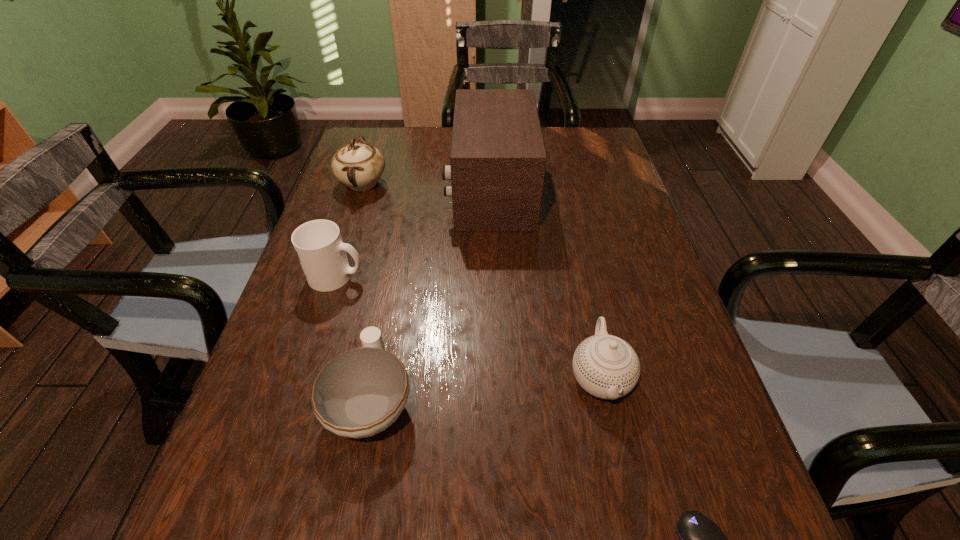
I want to click on object located at the far left corner, so (x=359, y=166).

Where is `free space at the far edge of the desktop`? free space at the far edge of the desktop is located at coordinates (553, 144).

I want to click on free location at the left edge, so click(372, 194).

The image size is (960, 540). I want to click on vacant space at the far left corner of the desktop, so click(x=398, y=127).

You are a GUI agent. You are given a task and a screenshot of the screen. Output one action in this format:
    pyautogui.click(x=<x>, y=<y>)
    Task: Click on the free point at the far right corner
    
    Given the screenshot: What is the action you would take?
    pyautogui.click(x=611, y=164)

Where is `vacant space that is in between the third farthest object and the third object from right to left`? Image resolution: width=960 pixels, height=540 pixels. vacant space that is in between the third farthest object and the third object from right to left is located at coordinates (414, 233).

Locate an element on the screen. The width and height of the screenshot is (960, 540). vacant space in between the radio receiver and the tallest chinaware is located at coordinates (426, 187).

This screenshot has width=960, height=540. What are the coordinates of `empty location between the radio receiver and the third farthest object` in the screenshot? It's located at (414, 233).

Identify the location of vacant area that lies between the rightmost chinaware and the mug. pos(468,326).

Where is `free space that is in between the tallest chinaware and the second tallest chinaware`? The width and height of the screenshot is (960, 540). free space that is in between the tallest chinaware and the second tallest chinaware is located at coordinates (482, 280).